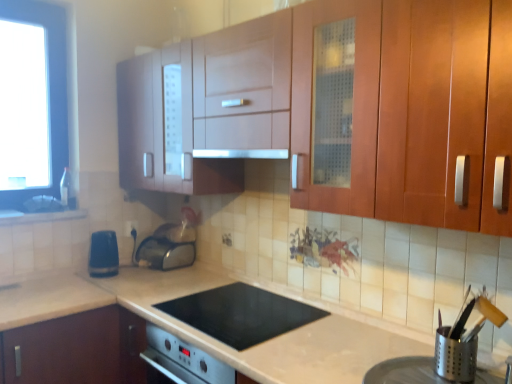
Identify the location of free space underneath matte wood cabinet at upper center (from a real-world perspective). (292, 314).